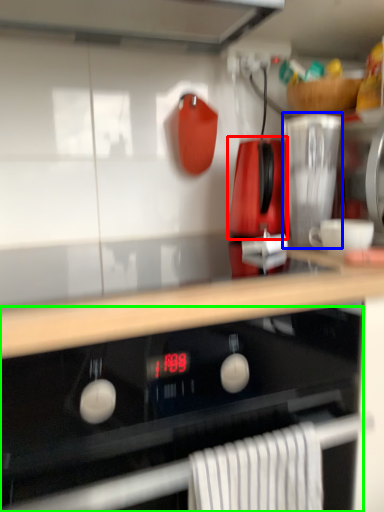
Question: Based on their relative distances, which object is nearer to kitchen appliance (highlighted by a red box)? Choose from kitchen appliance (highlighted by a blue box) and oven (highlighted by a green box).

Choices:
 (A) kitchen appliance
 (B) oven

Answer: (A)